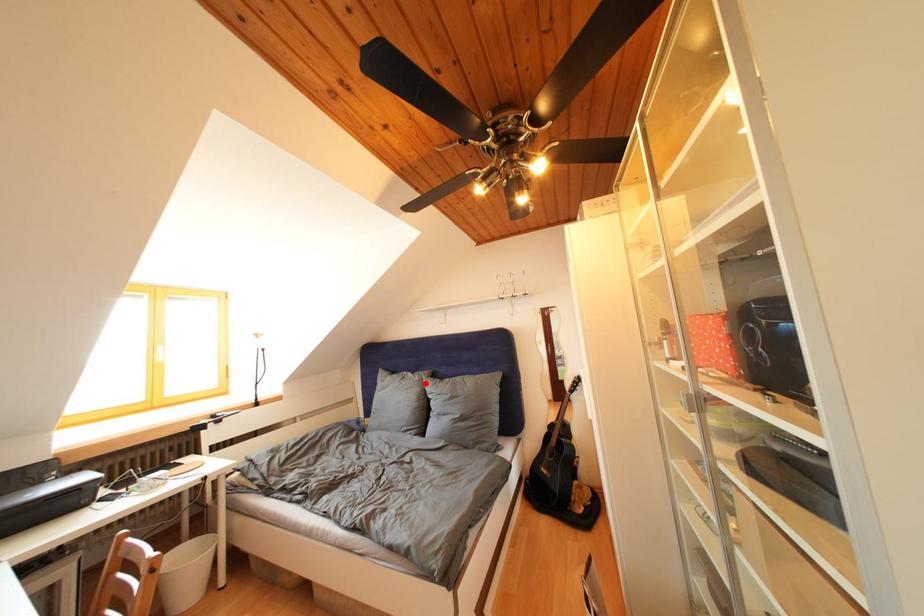
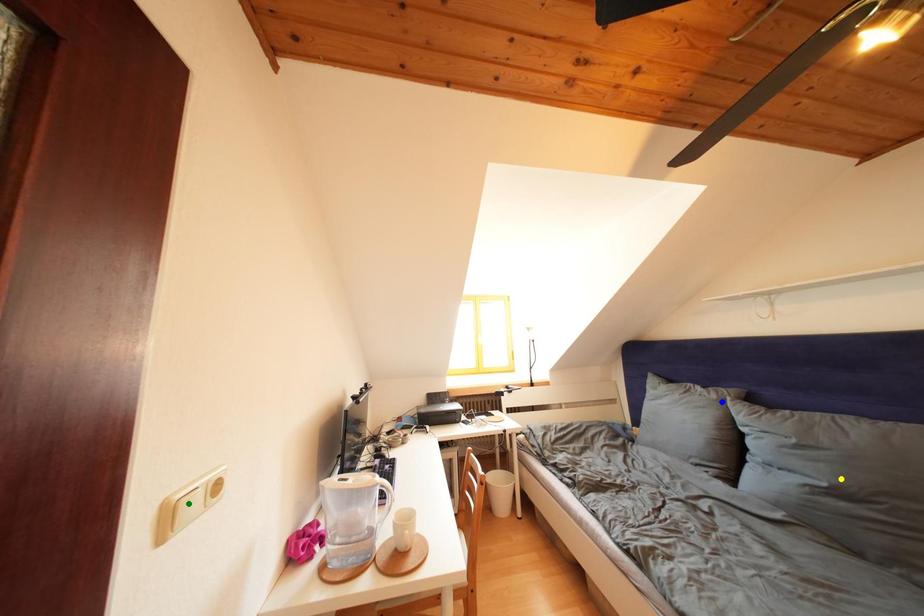
Question: I am providing you with two images of the same scene from different viewpoints. A red point is marked on the first image. You are given multiple points on the second image. Which spot in image 2 lines up with the point in image 1?

Choices:
 (A) green point
 (B) blue point
 (C) yellow point

Answer: (B)